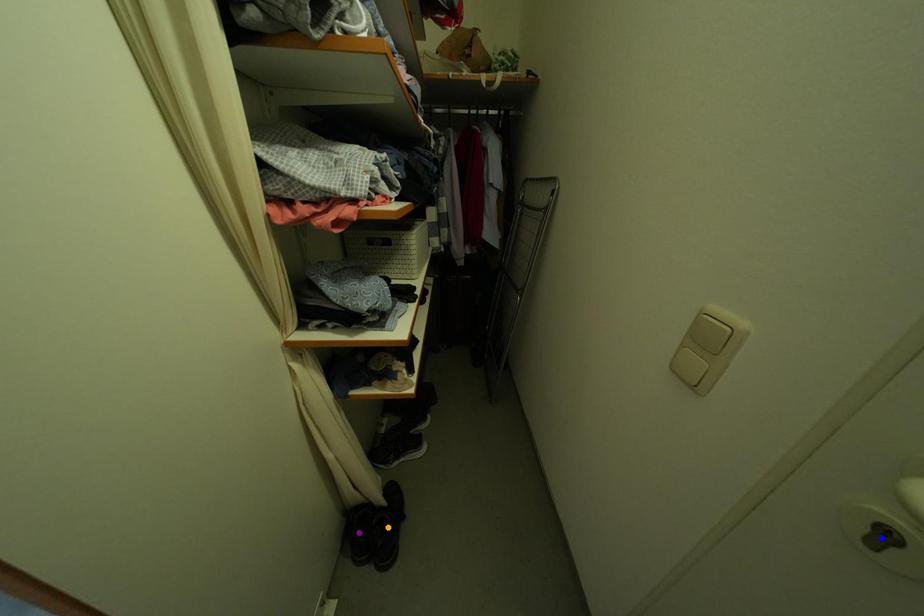
Order these from nearest to farthest:
A) blue point
B) purple point
C) orange point

orange point → purple point → blue point